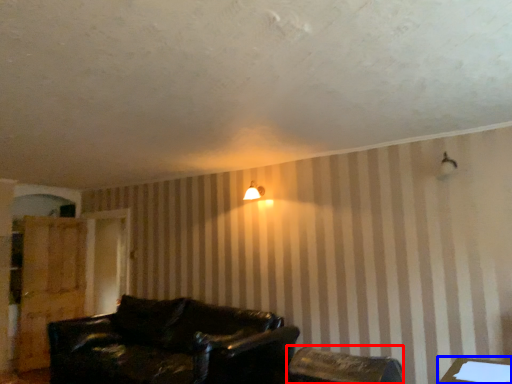
Question: Which object is closer to the camera taking this photo, chair (highlighted by a red box) or table (highlighted by a blue box)?

Choices:
 (A) chair
 (B) table

Answer: (B)